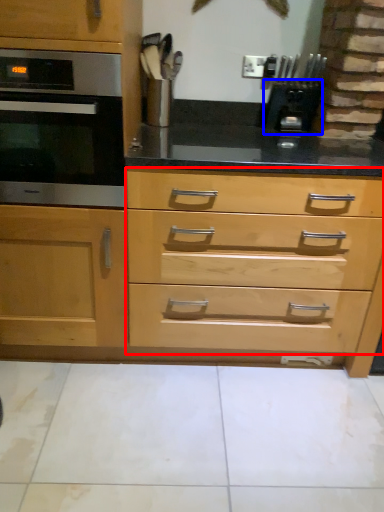
Question: Which object appears farthest to the camera in this image, drawer (highlighted by a red box) or appliance (highlighted by a blue box)?

Choices:
 (A) drawer
 (B) appliance

Answer: (B)